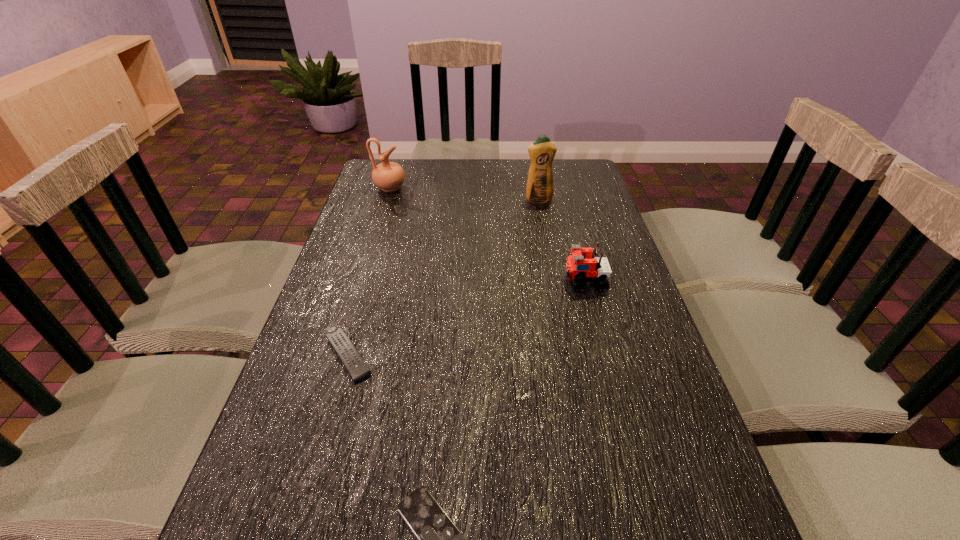
At what (x,y) coordinates should I click in order to perform the action: click on detergent. Please return your answer as a coordinate pair (x, y). Looking at the image, I should click on (540, 188).

The height and width of the screenshot is (540, 960). I want to click on the tallest object, so click(x=540, y=188).

At what (x,y) coordinates should I click in order to perform the action: click on the fourth shortest object. Please return your answer as a coordinate pair (x, y). This screenshot has height=540, width=960. Looking at the image, I should click on (389, 176).

Identify the location of pottery. (389, 176).

Identify the location of the third farthest object. (583, 265).

Image resolution: width=960 pixels, height=540 pixels. Find the location of `the third shortest object`. the third shortest object is located at coordinates (583, 265).

Locate an element on the screen. the second nearest object is located at coordinates (355, 365).

Identify the location of the fourth tallest object. (355, 365).

Where is `vacant point located on the label of the fourth nearest object`? vacant point located on the label of the fourth nearest object is located at coordinates (550, 261).

Where is `vacant space situated on the spout of the pottery`? The image size is (960, 540). vacant space situated on the spout of the pottery is located at coordinates (506, 188).